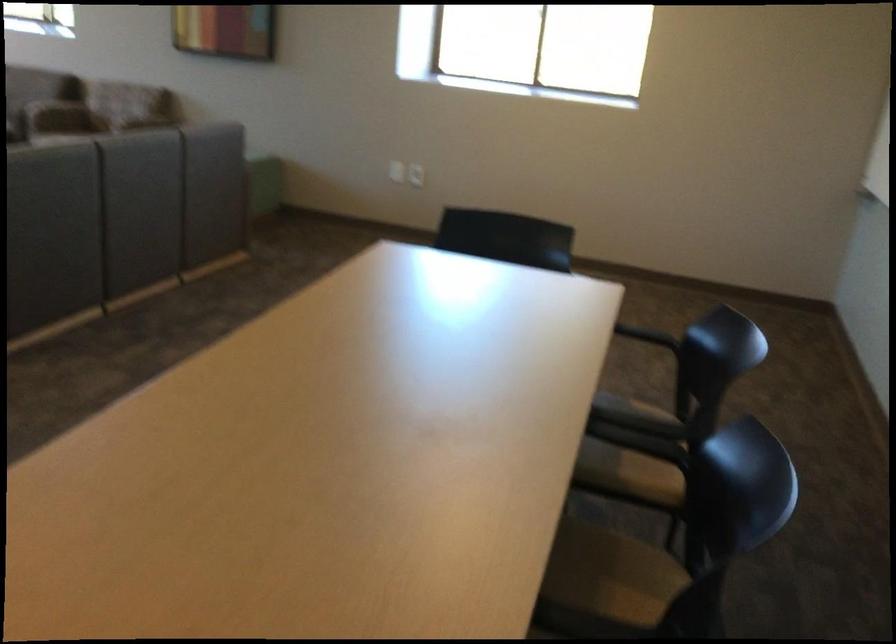
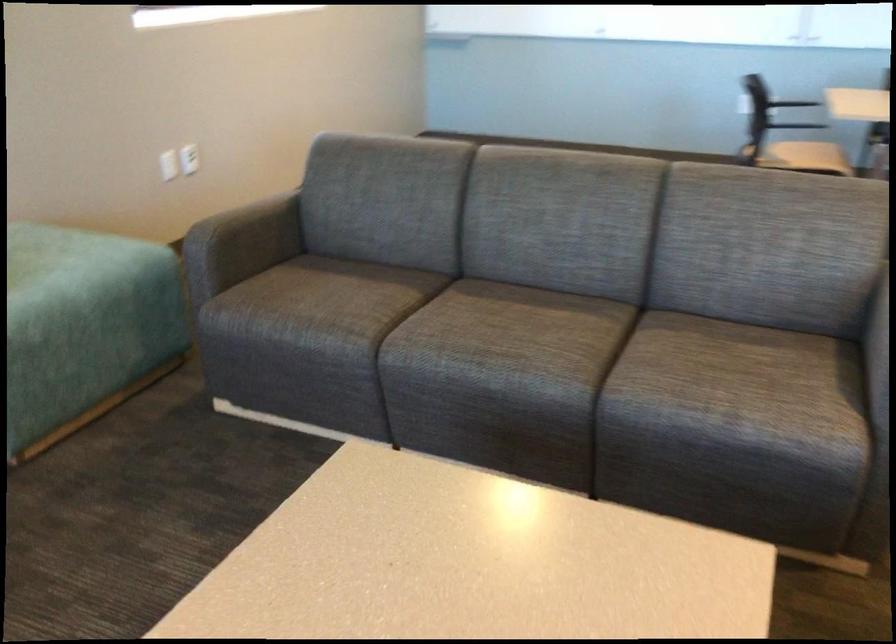
Locate, in the second image, the point that corresponds to (x=255, y=169) in the first image.

(56, 251)